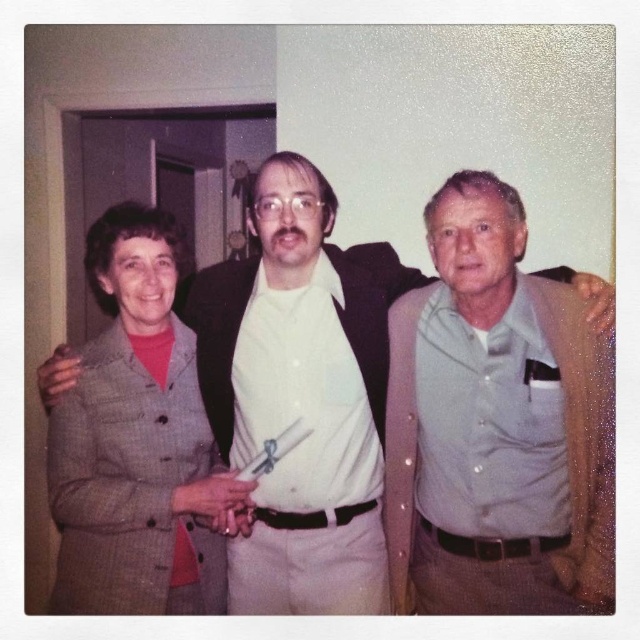
Based on the scene description, which object is taller between the gray cotton shirt at center and the gray woolen suit at left?

The gray cotton shirt at center is taller than the gray woolen suit at left.